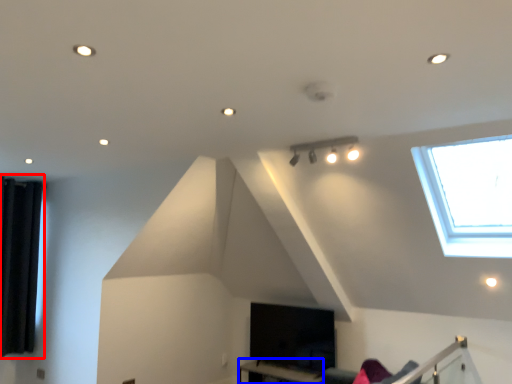
Question: Which of the following is the closest to the observer, curtain (highlighted by a red box) or table (highlighted by a blue box)?

Choices:
 (A) curtain
 (B) table

Answer: (B)